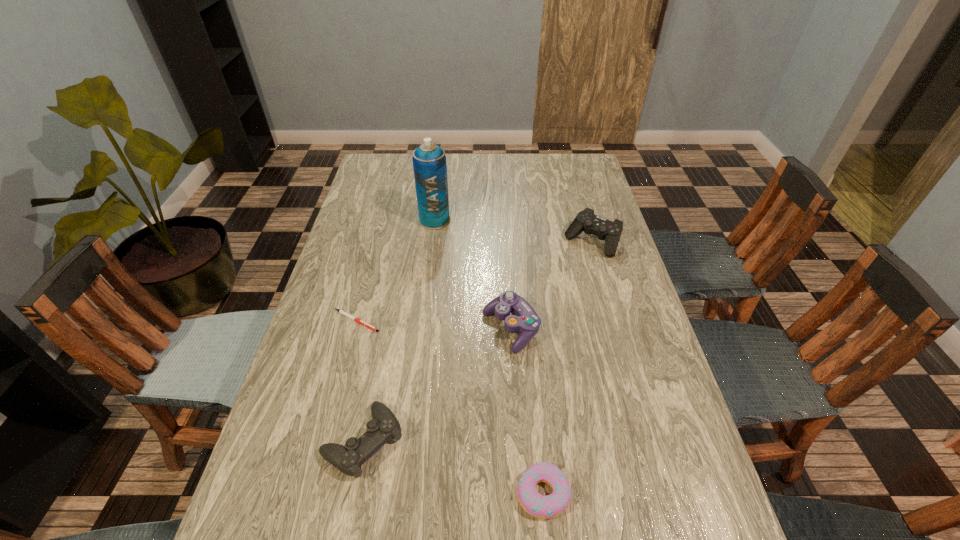
Find the location of `vacant space positioned 0.220m on the front of the second control from right to left`. vacant space positioned 0.220m on the front of the second control from right to left is located at coordinates (518, 438).

The image size is (960, 540). What are the coordinates of `free space located on the right of the nearest control` in the screenshot? It's located at (444, 441).

Identify the location of free space located 0.400m on the back of the fifth tallest object. This screenshot has height=540, width=960. (526, 320).

You are a GUI agent. You are given a task and a screenshot of the screen. Output one action in this format:
    pyautogui.click(x=<x>, y=<y>)
    Task: Click on the blank space located on the clicker of the shortest object
    The width and height of the screenshot is (960, 540).
    Given the screenshot: What is the action you would take?
    pyautogui.click(x=502, y=321)

In order to click on control that is at the left edge in this screenshot , I will do `click(348, 459)`.

Find the location of `pen that is at the left edge`. pen that is at the left edge is located at coordinates (340, 311).

The height and width of the screenshot is (540, 960). Find the location of `object situated at the right edge`. object situated at the right edge is located at coordinates (586, 220).

At what (x,y) coordinates should I click in order to perform the action: click on vacant space at the far edge of the desktop. Please return your answer as a coordinate pair (x, y). This screenshot has height=540, width=960. Looking at the image, I should click on (499, 154).

What are the coordinates of `vacant space at the left edge of the desktop` in the screenshot? It's located at (317, 331).

The image size is (960, 540). In the image, there is a desktop. In order to click on vacant space at the right edge in this screenshot , I will do `click(657, 411)`.